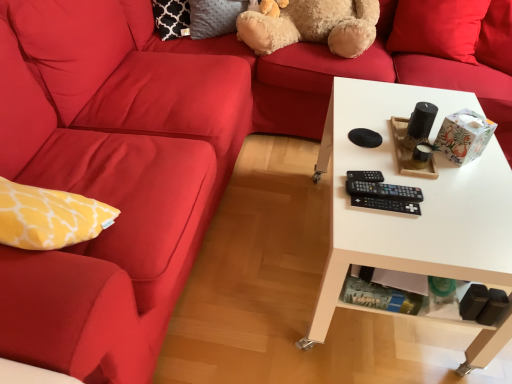
Identify the location of vacant space situated on the left part of black plastic remote at center, which appears as the 3th control when viewed from the back. This screenshot has width=512, height=384. (347, 201).